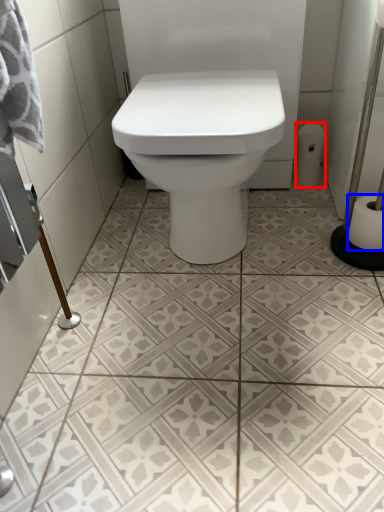
Question: Which of the following is the farthest to the observer, toilet paper (highlighted by a red box) or toilet paper (highlighted by a blue box)?

Choices:
 (A) toilet paper
 (B) toilet paper

Answer: (A)